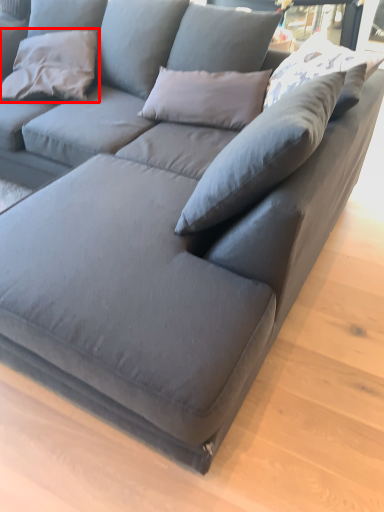
Question: Observing the image, what is the correct spatial positioning of pillow (annotated by the red box) in reference to pillow?

Choices:
 (A) left
 (B) right

Answer: (A)